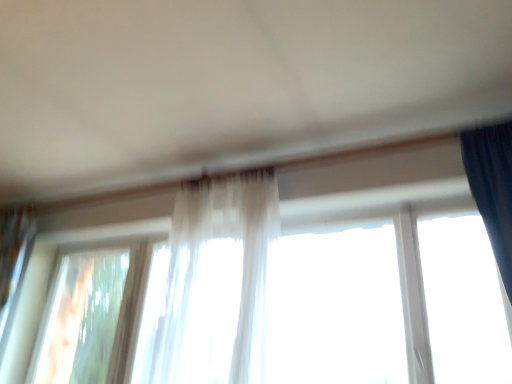
Question: Is translucent fabric at center, acting as the 1th window starting from the right, touching transparent glass window at lower left, placed as the second window when sorted from right to left?

Choices:
 (A) yes
 (B) no

Answer: (B)

Question: Is the depth of translucent fabric at center, which is the second window in left-to-right order, less than that of transparent glass window at lower left, which is the first window in left-to-right order?

Choices:
 (A) yes
 (B) no

Answer: (A)

Question: Is translucent fabric at center, which is the second window in left-to-right order, thinner than transparent glass window at lower left, placed as the second window when sorted from right to left?

Choices:
 (A) no
 (B) yes

Answer: (A)

Question: From the image's perspective, is translucent fabric at center, which is the second window in left-to-right order, on transparent glass window at lower left, placed as the second window when sorted from right to left?

Choices:
 (A) yes
 (B) no

Answer: (A)

Question: Is transparent glass window at lower left, which is the first window in left-to-right order, a part of translucent fabric at center, which is the second window in left-to-right order?

Choices:
 (A) yes
 (B) no

Answer: (B)

Question: From their relative heights in the image, would you say translucent fabric at center, which is the second window in left-to-right order, is taller or shorter than translucent fabric curtain at center?

Choices:
 (A) short
 (B) tall

Answer: (A)

Question: From a real-world perspective, is translucent fabric at center, which is the second window in left-to-right order, positioned above or below translucent fabric curtain at center?

Choices:
 (A) below
 (B) above

Answer: (A)

Question: Choose the correct answer: Is translucent fabric at center, acting as the 1th window starting from the right, inside translucent fabric curtain at center or outside it?

Choices:
 (A) outside
 (B) inside

Answer: (A)

Question: In terms of size, does translucent fabric at center, which is the second window in left-to-right order, appear bigger or smaller than translucent fabric curtain at center?

Choices:
 (A) small
 (B) big

Answer: (B)

Question: In the image, is translucent fabric at center, acting as the 1th window starting from the right, positioned in front of or behind transparent glass window at lower left, which is the first window in left-to-right order?

Choices:
 (A) behind
 (B) front

Answer: (B)

Question: From the image's perspective, is translucent fabric at center, acting as the 1th window starting from the right, positioned above or below transparent glass window at lower left, placed as the second window when sorted from right to left?

Choices:
 (A) above
 (B) below

Answer: (A)

Question: Visually, is translucent fabric at center, which is the second window in left-to-right order, positioned to the left or to the right of transparent glass window at lower left, placed as the second window when sorted from right to left?

Choices:
 (A) left
 (B) right

Answer: (B)

Question: From a real-world perspective, is translucent fabric at center, which is the second window in left-to-right order, above or below transparent glass window at lower left, which is the first window in left-to-right order?

Choices:
 (A) below
 (B) above

Answer: (B)

Question: Does point (209, 215) appear closer or farther from the camera than point (64, 370)?

Choices:
 (A) farther
 (B) closer

Answer: (B)

Question: From their relative heights in the image, would you say translucent fabric curtain at center is taller or shorter than transparent glass window at lower left, which is the first window in left-to-right order?

Choices:
 (A) tall
 (B) short

Answer: (A)